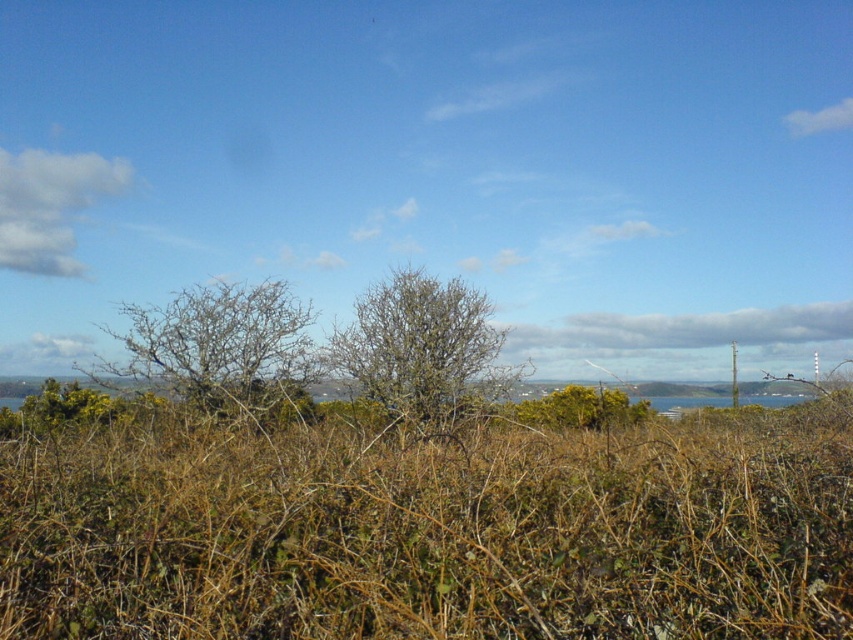
Measure the distance between brown dry grass at center and green leafy bush at center.

brown dry grass at center is 8.81 meters away from green leafy bush at center.

Does point (848, 534) come farther from viewer compared to point (595, 428)?

No, it is in front of (595, 428).

Does point (838, 451) lie behind point (532, 420)?

No, (838, 451) is in front of (532, 420).

This screenshot has width=853, height=640. In order to click on brown dry grass at center in this screenshot , I will do `click(433, 531)`.

Between bare branches at center and green leafy bush at lower left, which one has more height?

bare branches at center is taller.

Does point (398, 344) come behind point (115, 419)?

Yes.

Who is more forward, [454,364] or [22,429]?

Point [22,429] is in front.

The image size is (853, 640). Identify the location of bare branches at center. pos(424,349).

Who is lower down, brown dry grass at center or green leafy bush at lower left?

green leafy bush at lower left

Is point (247, 525) positioned in front of point (115, 401)?

Yes, point (247, 525) is in front of point (115, 401).

In the scene shown: Who is more forward, (607, 561) or (62, 401)?

Positioned in front is point (607, 561).

I want to click on brown dry grass at center, so click(433, 531).